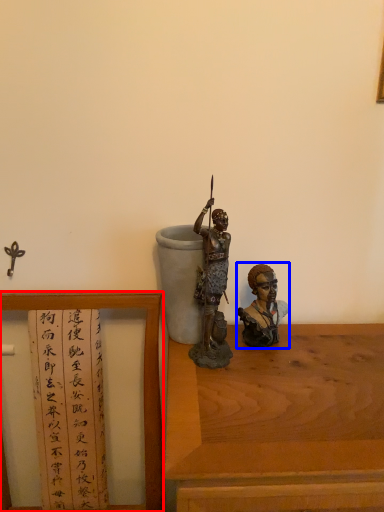
Question: Which point is closer to the camera, furniture (highlighted by a red box) or person (highlighted by a blue box)?

Choices:
 (A) furniture
 (B) person

Answer: (A)